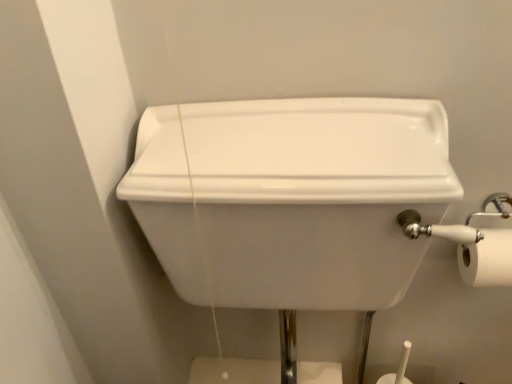
Question: Is the position of white glossy sink at center less distant than that of white matte toilet paper at right?

Choices:
 (A) no
 (B) yes

Answer: (B)

Question: Is white glossy sink at center thinner than white matte toilet paper at right?

Choices:
 (A) no
 (B) yes

Answer: (A)

Question: Considering the relative positions of white glossy sink at center and white matte toilet paper at right in the image provided, is white glossy sink at center to the right of white matte toilet paper at right from the viewer's perspective?

Choices:
 (A) no
 (B) yes

Answer: (A)

Question: From a real-world perspective, is white glossy sink at center below white matte toilet paper at right?

Choices:
 (A) no
 (B) yes

Answer: (B)

Question: Does white glossy sink at center have a greater height compared to white matte toilet paper at right?

Choices:
 (A) yes
 (B) no

Answer: (A)

Question: Is white glossy sink at center not within white matte toilet paper at right?

Choices:
 (A) yes
 (B) no

Answer: (A)

Question: Is there a large distance between white matte toilet paper at right and white glossy sink at center?

Choices:
 (A) yes
 (B) no

Answer: (B)

Question: Considering the relative sizes of white matte toilet paper at right and white glossy sink at center in the image provided, is white matte toilet paper at right taller than white glossy sink at center?

Choices:
 (A) yes
 (B) no

Answer: (B)

Question: Can white glossy sink at center be found inside white matte toilet paper at right?

Choices:
 (A) yes
 (B) no

Answer: (B)

Question: Is white matte toilet paper at right shorter than white glossy sink at center?

Choices:
 (A) no
 (B) yes

Answer: (B)

Question: Does white matte toilet paper at right have a smaller size compared to white glossy sink at center?

Choices:
 (A) yes
 (B) no

Answer: (A)

Question: Is the position of white matte toilet paper at right less distant than that of white glossy sink at center?

Choices:
 (A) no
 (B) yes

Answer: (A)

Question: Is white matte toilet paper at right in front of or behind white glossy sink at center in the image?

Choices:
 (A) behind
 (B) front

Answer: (A)